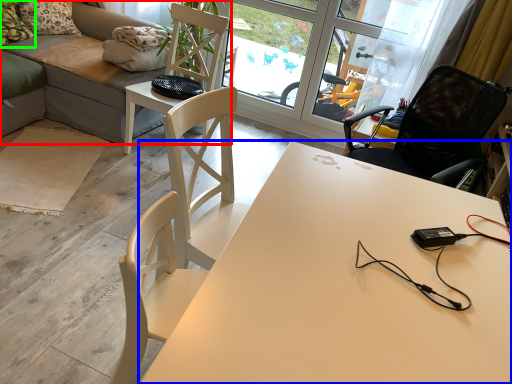
Question: Estimate the real-world distances between objects in this image. Which object is farther from studio couch (highlighted by a red box), desk (highlighted by a blue box) or pillow (highlighted by a green box)?

Choices:
 (A) desk
 (B) pillow

Answer: (A)